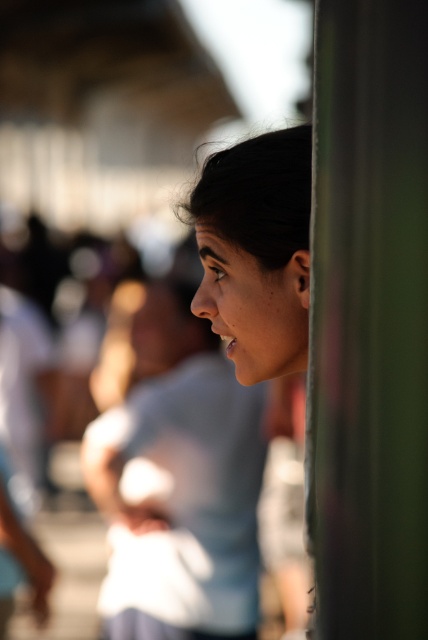
Does green metallic pole at right have a greater width compared to smooth skin face at center?

No.

Based on the photo, which is below, green metallic pole at right or smooth skin face at center?

green metallic pole at right is below.

What do you see at coordinates (368, 321) in the screenshot? The width and height of the screenshot is (428, 640). I see `green metallic pole at right` at bounding box center [368, 321].

Find the location of a particular element. The width and height of the screenshot is (428, 640). green metallic pole at right is located at coordinates (368, 321).